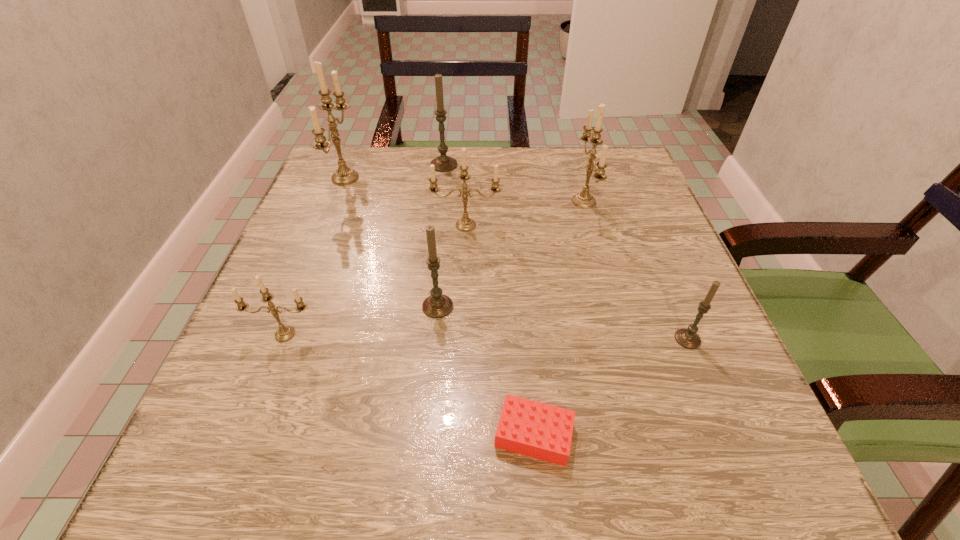
At what (x,y) coordinates should I click in order to perform the action: click on the nearest metallic candle. Please return your answer as a coordinate pair (x, y). Image resolution: width=960 pixels, height=540 pixels. Looking at the image, I should click on (285, 333).

Locate an element on the screen. This screenshot has height=540, width=960. Lego is located at coordinates (534, 429).

Locate an element on the screen. the nearest object is located at coordinates (534, 429).

Identify the location of vacant space situated on the front of the tallest object. (304, 281).

Identify the location of vacant position located on the right of the biggest gray candle. This screenshot has width=960, height=540. (613, 165).

Find the location of a particular element. The height and width of the screenshot is (540, 960). vacant space situated on the left of the seventh object from left to right is located at coordinates (417, 201).

I want to click on vacant position located 0.190m on the right of the fifth farthest object, so (562, 307).

Find the location of a particular element. The width and height of the screenshot is (960, 540). vacant area situated on the left of the second metallic candle from right to left is located at coordinates (384, 225).

Locate an element on the screen. vacant space located 0.300m on the left of the smallest gray candle is located at coordinates (492, 339).

In order to click on vacant area situated 0.100m on the back of the nearest metallic candle in this screenshot , I will do `click(305, 284)`.